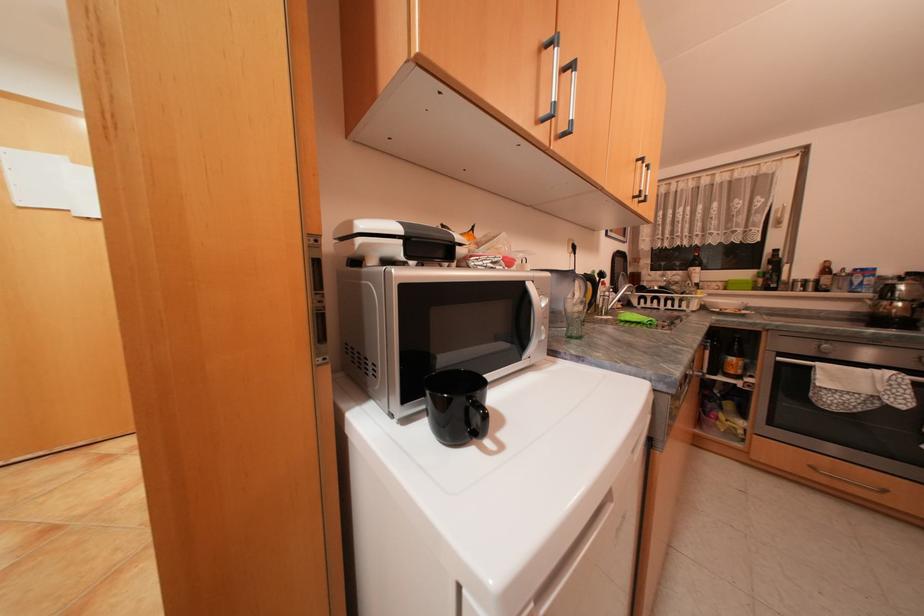
What do you see at coordinates (821, 347) in the screenshot?
I see `the oven control knob` at bounding box center [821, 347].